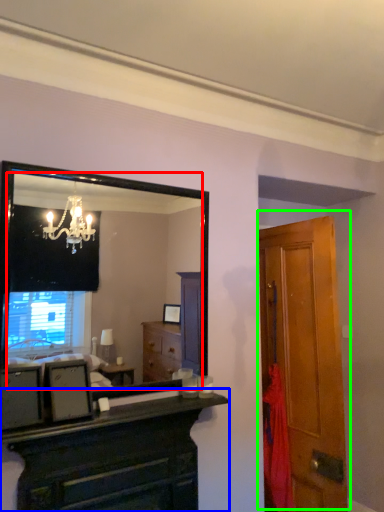
Question: Based on their relative distances, which object is nearer to mirror (highlighted by a red box)? Choose from chest of drawers (highlighted by a blue box) and door (highlighted by a green box).

Choices:
 (A) chest of drawers
 (B) door

Answer: (B)